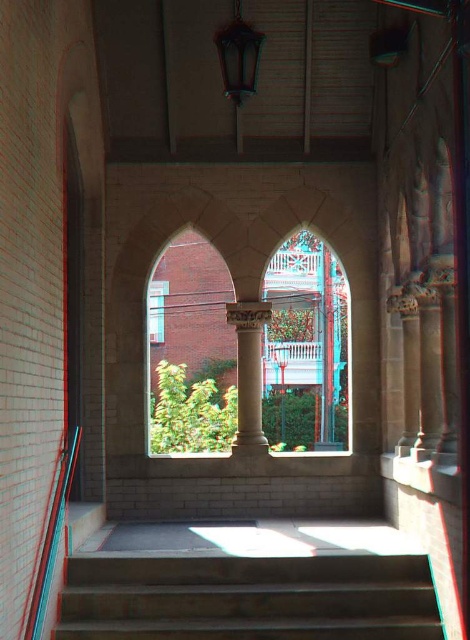
Question: Can you confirm if white marble column at center is bigger than metallic glossy handrail at lower left?

Choices:
 (A) yes
 (B) no

Answer: (B)

Question: Is concrete stairs at lower center bigger than wooden lantern at upper center?

Choices:
 (A) no
 (B) yes

Answer: (B)

Question: Which point is closer to the camera taking this photo?

Choices:
 (A) (239, 3)
 (B) (34, 592)

Answer: (B)

Question: Can you confirm if concrete stairs at lower center is positioned above white marble column at center?

Choices:
 (A) yes
 (B) no

Answer: (B)

Question: Which object appears closest to the camera in this image?

Choices:
 (A) wooden lantern at upper center
 (B) metallic glossy handrail at lower left
 (C) white marble column at center
 (D) concrete stairs at lower center

Answer: (B)

Question: Which of these objects is positioned farthest from the wooden lantern at upper center?

Choices:
 (A) white marble column at center
 (B) concrete stairs at lower center

Answer: (B)